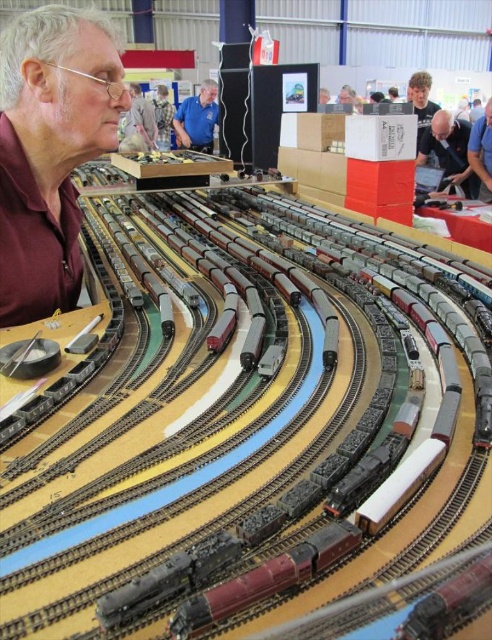
Question: Observing the image, what is the correct spatial positioning of light brown leather jacket at upper center in reference to camouflage fabric shirt at center?

Choices:
 (A) left
 (B) right

Answer: (A)

Question: Which object is the farthest from the matte black laptop at upper right?

Choices:
 (A) light brown leather jacket at upper center
 (B) matte brown shirt at left

Answer: (A)

Question: Which of the following is the closest to the observer?

Choices:
 (A) light brown leather jacket at upper center
 (B) matte black laptop at upper right
 (C) matte brown shirt at left

Answer: (C)

Question: Can you confirm if blue fabric shirt at upper center is bigger than light brown leather jacket at upper center?

Choices:
 (A) yes
 (B) no

Answer: (B)

Question: From the image, what is the correct spatial relationship of blonde hair at upper right in relation to camouflage fabric shirt at center?

Choices:
 (A) left
 (B) right

Answer: (B)

Question: Among these objects, which one is farthest from the camera?

Choices:
 (A) light brown leather jacket at upper center
 (B) matte black laptop at upper right

Answer: (A)